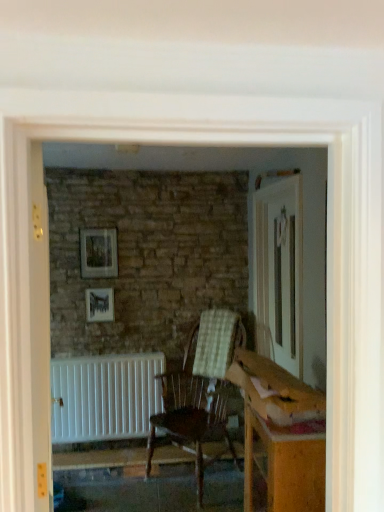
Identify the location of vacant region below white matte radiator at lower left (from a real-world perspective). The image size is (384, 512). click(109, 444).